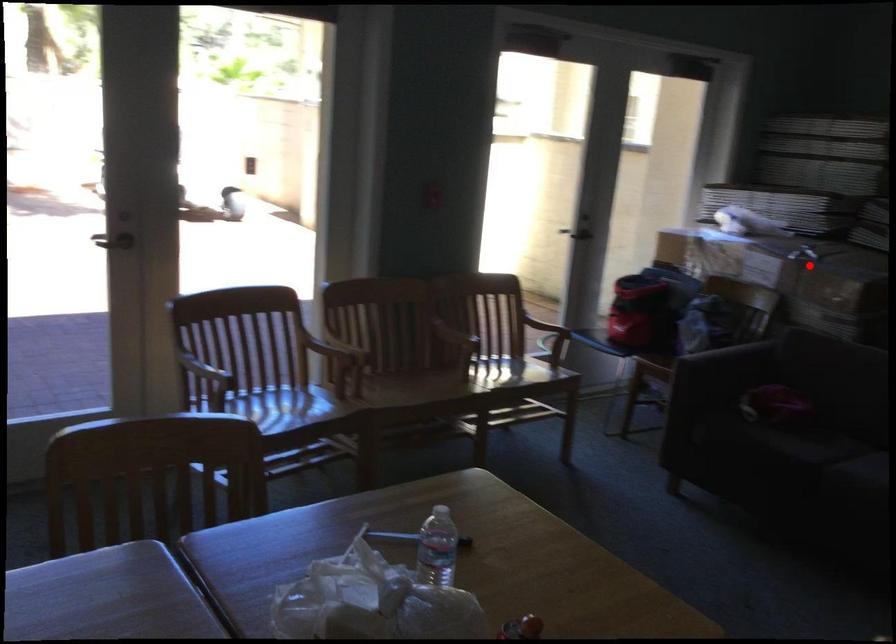
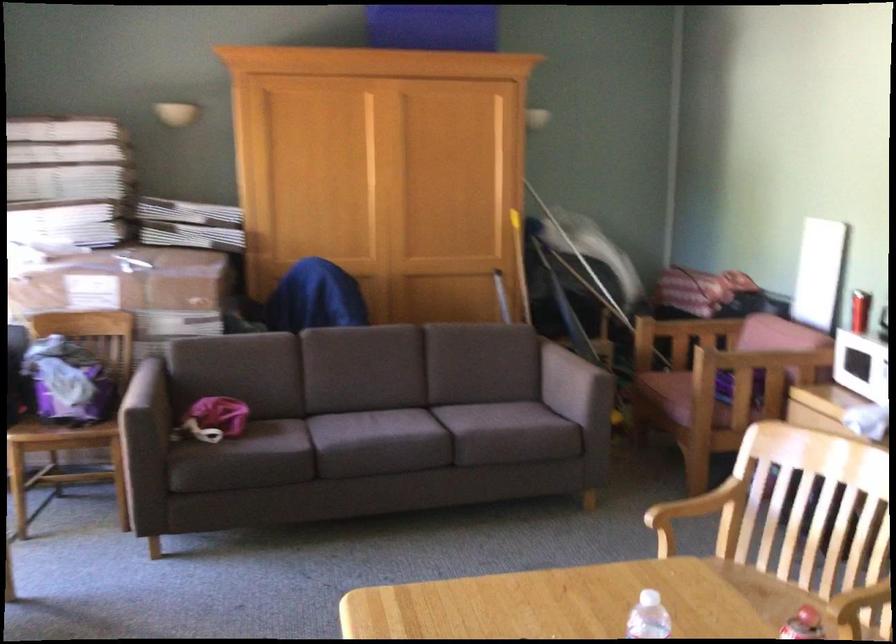
Where in the second image is the point corresponding to the highlighted location from the first image?

(131, 290)